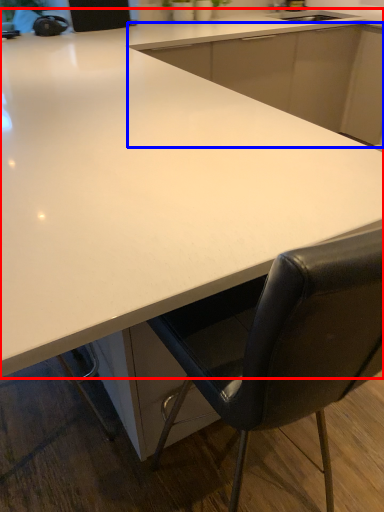
Question: Which point is closer to the camera, countertop (highlighted by a red box) or cabinetry (highlighted by a blue box)?

Choices:
 (A) countertop
 (B) cabinetry

Answer: (A)